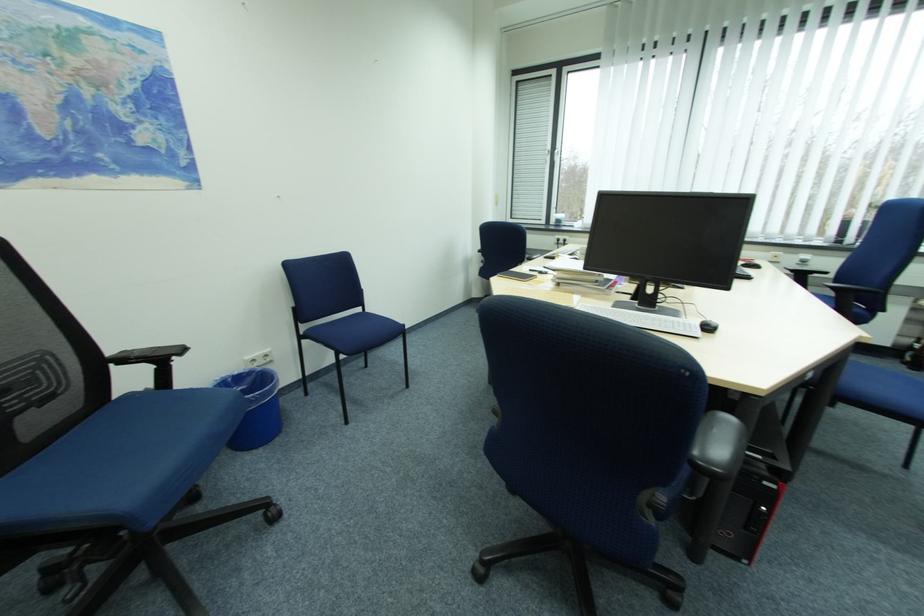
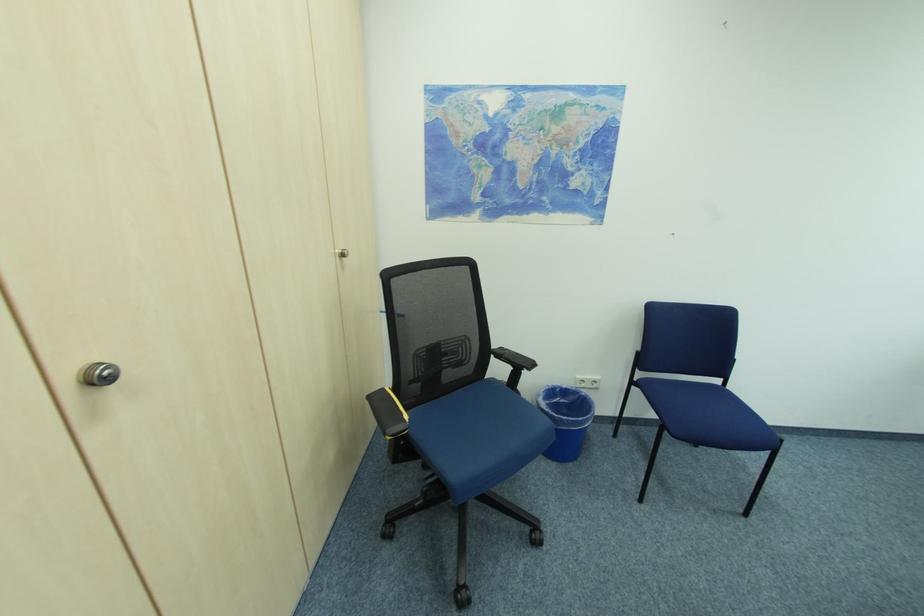
Question: Based on the continuous images, in which direction is the camera rotating? Reply with the corresponding letter.

Choices:
 (A) Left
 (B) Right
 (C) Up
 (D) Down

Answer: (A)